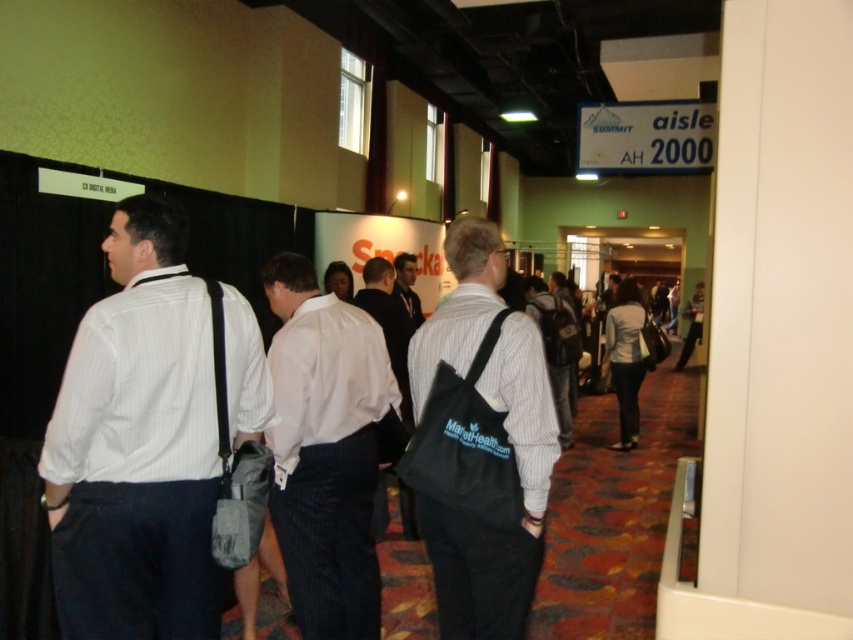
Is point (408, 500) behind point (560, 317)?

No.

Who is taller, dark gray suit at center or striped shirt at center?

Standing taller between the two is striped shirt at center.

Between point (358, 300) and point (550, 353), which one is positioned in front?

Positioned in front is point (358, 300).

The image size is (853, 640). In order to click on dark gray suit at center in this screenshot , I will do `click(387, 323)`.

Does point (84, 433) come in front of point (526, 509)?

Yes.

Between white striped shirt at center and black fabric bag at center, which one is positioned higher?

white striped shirt at center is above.

Identify the location of white striped shirt at center. (137, 445).

I want to click on white striped shirt at center, so click(137, 445).

Who is shorter, black fabric bag at center or striped shirt at center?

With less height is black fabric bag at center.

What do you see at coordinates (480, 444) in the screenshot? I see `black fabric bag at center` at bounding box center [480, 444].

Does point (521, 454) lie behind point (566, 310)?

No, (521, 454) is closer to viewer.

Locate an element on the screen. black fabric bag at center is located at coordinates pos(480,444).